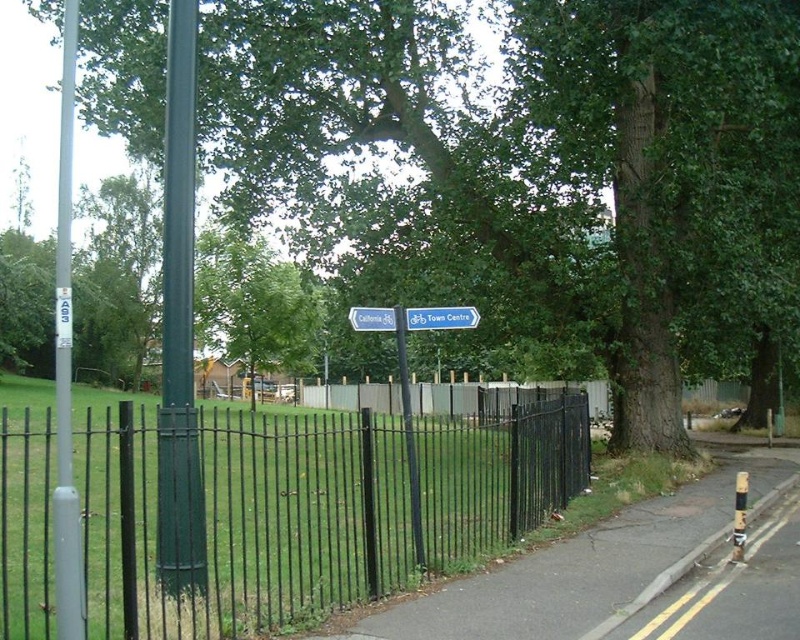
Does black metal fence at center appear under blue plastic sign at center?

Yes.

Which is below, black metal fence at center or blue plastic sign at center?

black metal fence at center

Which is behind, point (218, 476) or point (429, 314)?

The point (218, 476) is more distant.

I want to click on black metal fence at center, so click(x=237, y=518).

Who is higher up, green matte pole at left or blue plastic sign at center?

green matte pole at left is higher up.

Is green matte pole at left to the right of blue plastic sign at center from the viewer's perspective?

In fact, green matte pole at left is to the left of blue plastic sign at center.

Locate an element on the screen. The width and height of the screenshot is (800, 640). green matte pole at left is located at coordinates (180, 326).

Does black asphalt pavement at lower right have a lesser height compared to blue plastic sign at center?

Incorrect, black asphalt pavement at lower right's height does not fall short of blue plastic sign at center's.

Does black asphalt pavement at lower right appear on the right side of blue plastic sign at center?

Correct, you'll find black asphalt pavement at lower right to the right of blue plastic sign at center.

Describe the element at coordinates (588, 564) in the screenshot. The height and width of the screenshot is (640, 800). I see `black asphalt pavement at lower right` at that location.

Where is `black asphalt pavement at lower right`? The image size is (800, 640). black asphalt pavement at lower right is located at coordinates (x=588, y=564).